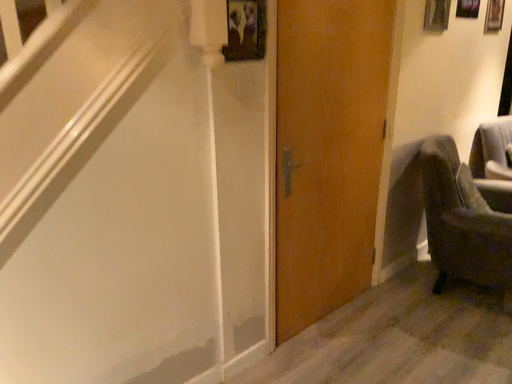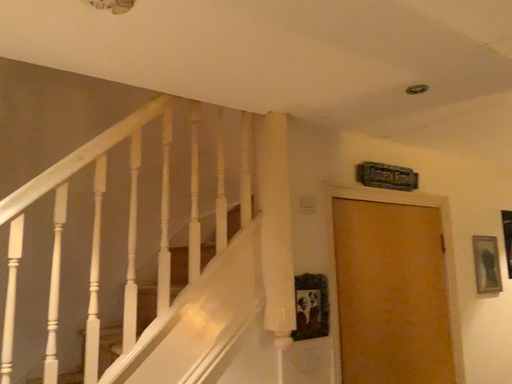
Question: How did the camera likely rotate when shooting the video?

Choices:
 (A) rotated right
 (B) rotated left

Answer: (B)